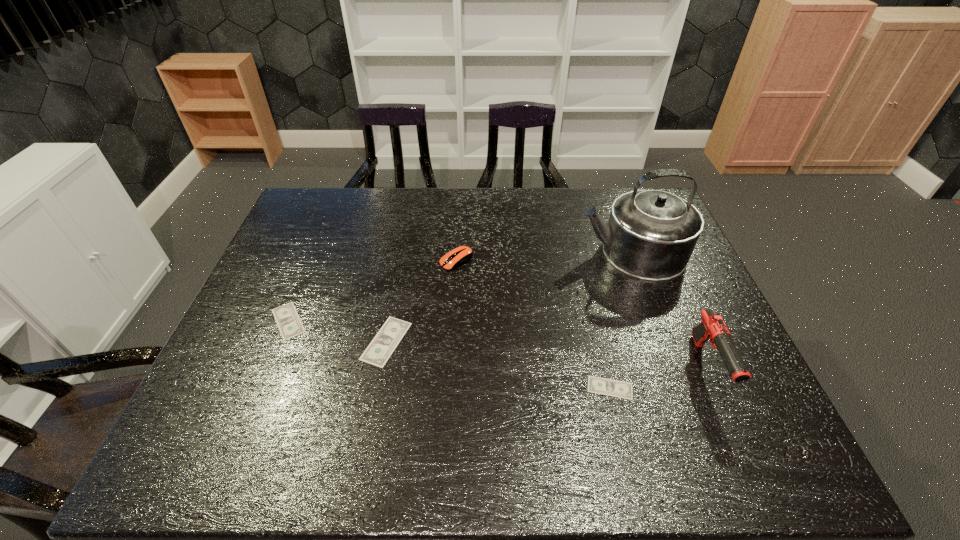
You are a GUI agent. You are given a task and a screenshot of the screen. Output one action in this format:
    pyautogui.click(x=<x>, y=<y>)
    Task: Click on the object located in the left edge section of the desktop
    The height and width of the screenshot is (540, 960).
    Given the screenshot: What is the action you would take?
    pyautogui.click(x=288, y=321)

Where is `kettle positioned at the right edge`? The image size is (960, 540). kettle positioned at the right edge is located at coordinates (651, 234).

At what (x,y) coordinates should I click in order to perform the action: click on gun present at the right edge. Please return your answer as a coordinate pair (x, y). Looking at the image, I should click on (712, 328).

You are a GUI agent. You are given a task and a screenshot of the screen. Output one action in this format:
    pyautogui.click(x=<x>, y=<y>)
    Task: Click on the object that is at the far right corner
    This screenshot has height=540, width=960.
    Given the screenshot: What is the action you would take?
    pyautogui.click(x=651, y=234)

This screenshot has width=960, height=540. Find the location of `object positioned at the near right corner`. object positioned at the near right corner is located at coordinates (712, 328).

The width and height of the screenshot is (960, 540). In order to click on vacant space at the far edge in this screenshot , I will do `click(570, 208)`.

You are a GUI agent. You are given a task and a screenshot of the screen. Output one action in this format:
    pyautogui.click(x=<x>, y=<y>)
    Task: Click on the vacant space at the near edge
    This screenshot has width=960, height=540.
    Given the screenshot: What is the action you would take?
    pyautogui.click(x=655, y=411)

You are a GUI agent. You are given a task and a screenshot of the screen. Output one action in this format:
    pyautogui.click(x=<x>, y=<y>)
    Task: Click on the vacant region at the left edge of the desktop
    The image size is (960, 540).
    Given the screenshot: What is the action you would take?
    pyautogui.click(x=293, y=287)

Image resolution: width=960 pixels, height=540 pixels. In the image, there is a desktop. Find the location of `vacant area at the right edge`. vacant area at the right edge is located at coordinates (675, 312).

The height and width of the screenshot is (540, 960). Find the location of `blank space at the far left corner of the desktop`. blank space at the far left corner of the desktop is located at coordinates (317, 190).